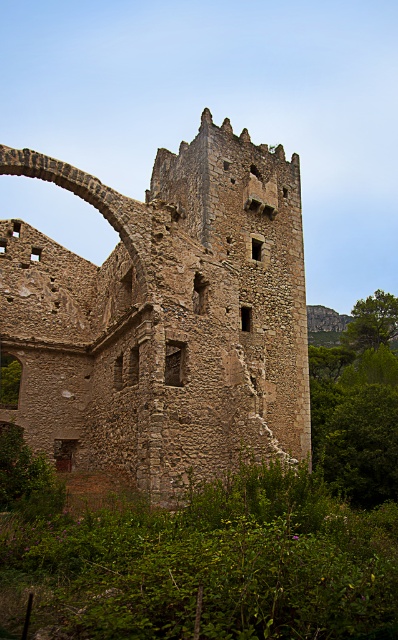
You are an archaeologist examining the ancient stone structure. You notice the rustic stone tower at center and the green leafy vegetation at center. Which object is closer to your current position?

The rustic stone tower at center is closer to you than the green leafy vegetation at center because it is positioned further to the viewer.

You are an archaeologist examining the ancient stone structure. You notice both the rustic stone tower at center and the green leafy vegetation at center. Which object is positioned more to the east side of the structure?

The rustic stone tower at center is to the left of green leafy vegetation at center, so the tower is positioned more to the east side if the vegetation is on the west side.